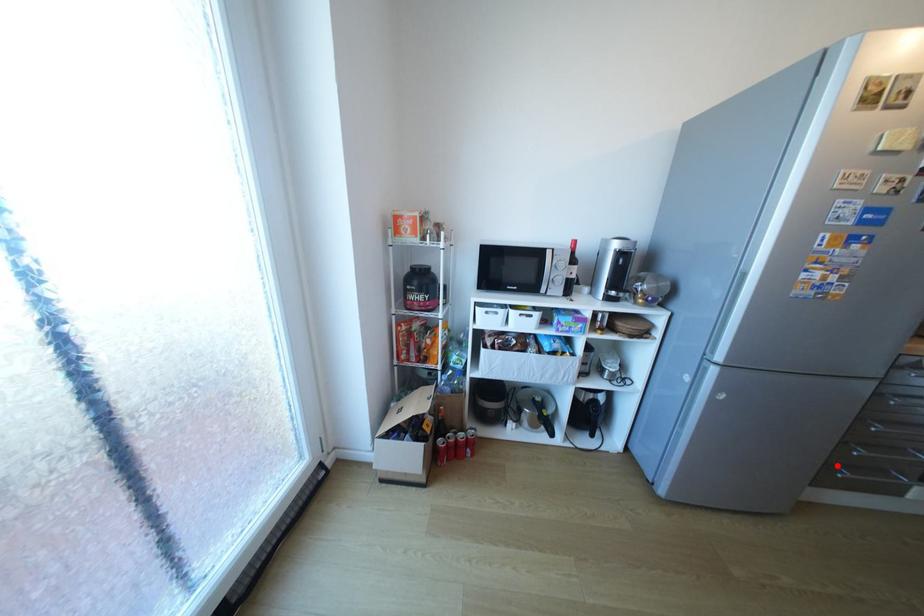
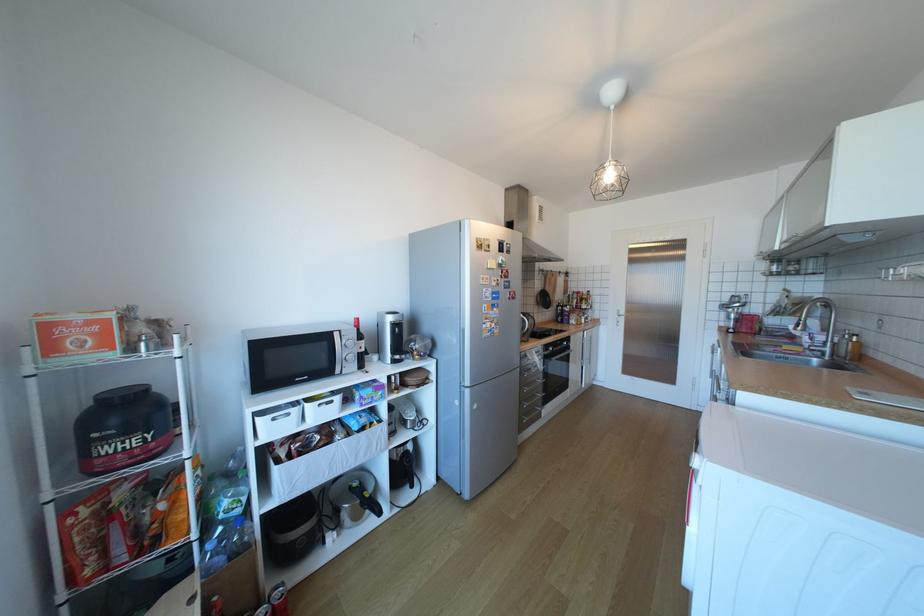
Locate, in the second image, the point that corresponds to the highlighted location in the first image.

(529, 419)